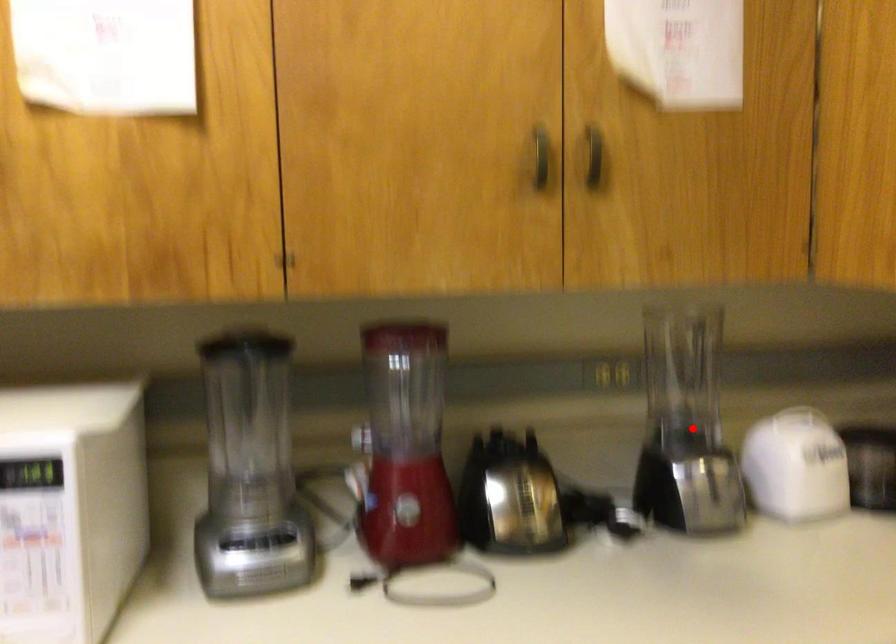
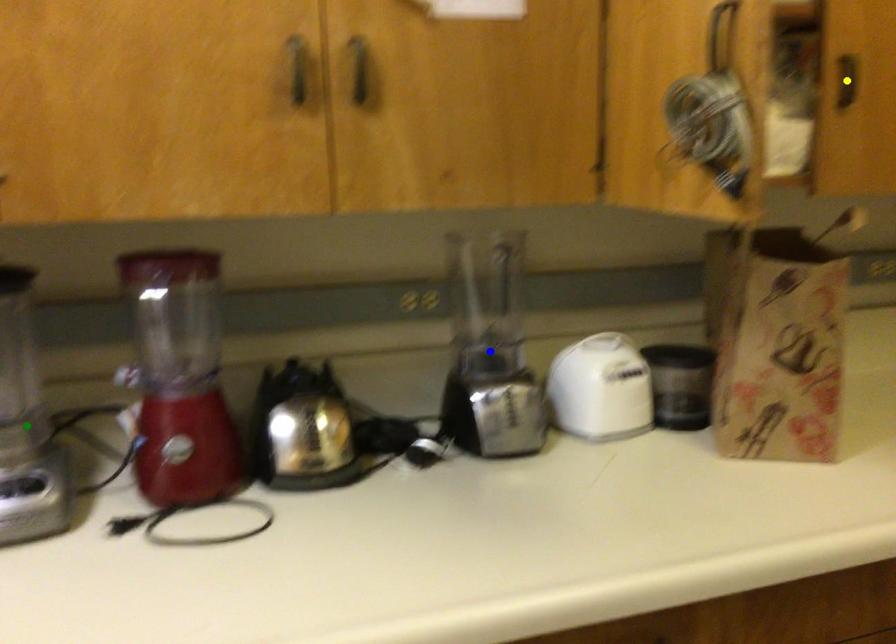
Question: I am providing you with two images of the same scene from different viewpoints. A red point is marked on the first image. You are given multiple points on the second image. Which spot in image 2 lines up with the point in image 1?

Choices:
 (A) green point
 (B) blue point
 (C) yellow point

Answer: (B)